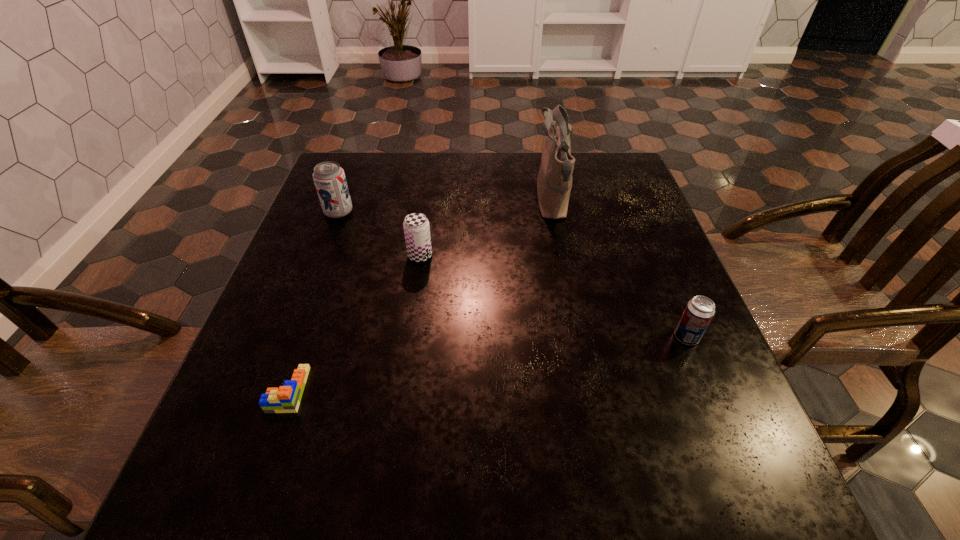
Image resolution: width=960 pixels, height=540 pixels. Identify the location of object present at the right edge. (699, 311).

The height and width of the screenshot is (540, 960). In the image, there is a desktop. What are the coordinates of `free space at the far edge` in the screenshot? It's located at (496, 173).

Where is `vacant position at the left edge of the desktop`? vacant position at the left edge of the desktop is located at coordinates click(x=330, y=280).

Find the location of a particular element. This screenshot has height=540, width=960. vacant space at the right edge is located at coordinates (710, 352).

In the image, there is a desktop. Find the location of `vacant region at the far left corner`. vacant region at the far left corner is located at coordinates (346, 177).

In the image, there is a desktop. Where is `blank space at the far right corner`? This screenshot has height=540, width=960. blank space at the far right corner is located at coordinates (629, 189).

This screenshot has width=960, height=540. What are the coordinates of `free spot between the nearest beer can and the shoulder bag` in the screenshot? It's located at (619, 269).

Find the location of a particular element. This screenshot has width=960, height=540. free space between the nearest object and the rightmost beer can is located at coordinates (488, 363).

The width and height of the screenshot is (960, 540). I want to click on free space that is in between the Lego and the second beer can from right to left, so click(354, 322).

Locate an element on the screen. This screenshot has width=960, height=540. free space between the leftmost beer can and the second beer can from right to left is located at coordinates (379, 234).